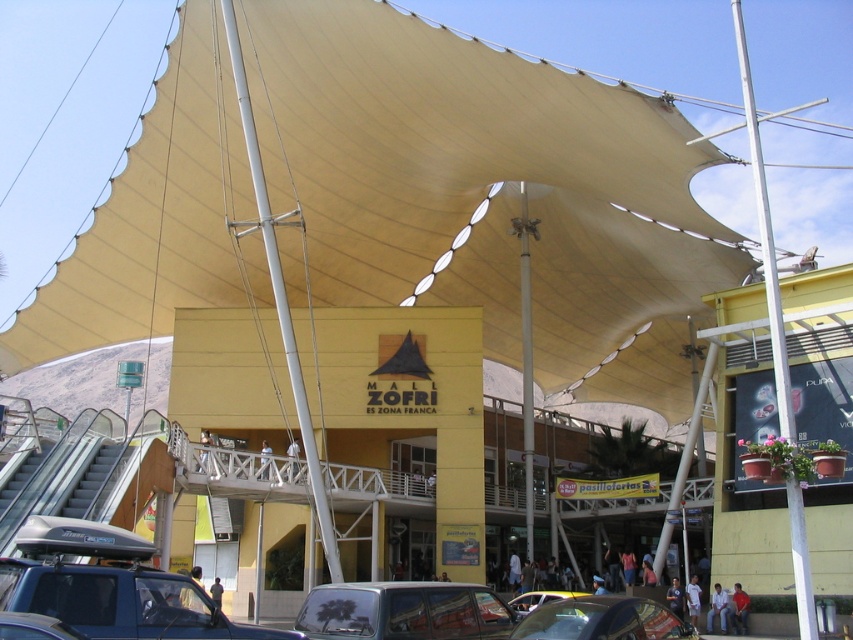
Question: Is blue matte car at lower left to the right of metallic silver car at center from the viewer's perspective?

Choices:
 (A) no
 (B) yes

Answer: (A)

Question: Among these objects, which one is farthest from the camera?

Choices:
 (A) white metallic pole at right
 (B) blue matte car at lower left
 (C) shiny black car at center

Answer: (A)

Question: Which point appears farthest from the camera in this image?

Choices:
 (A) (412, 609)
 (B) (538, 604)
 (C) (757, 173)

Answer: (B)

Question: Does silver metallic car at center appear over shiny black car at center?

Choices:
 (A) yes
 (B) no

Answer: (B)

Question: Which point is farther to the camera?

Choices:
 (A) (444, 618)
 (B) (183, 589)

Answer: (A)

Question: Can you confirm if silver metallic car at center is bigger than metallic silver car at center?

Choices:
 (A) yes
 (B) no

Answer: (B)